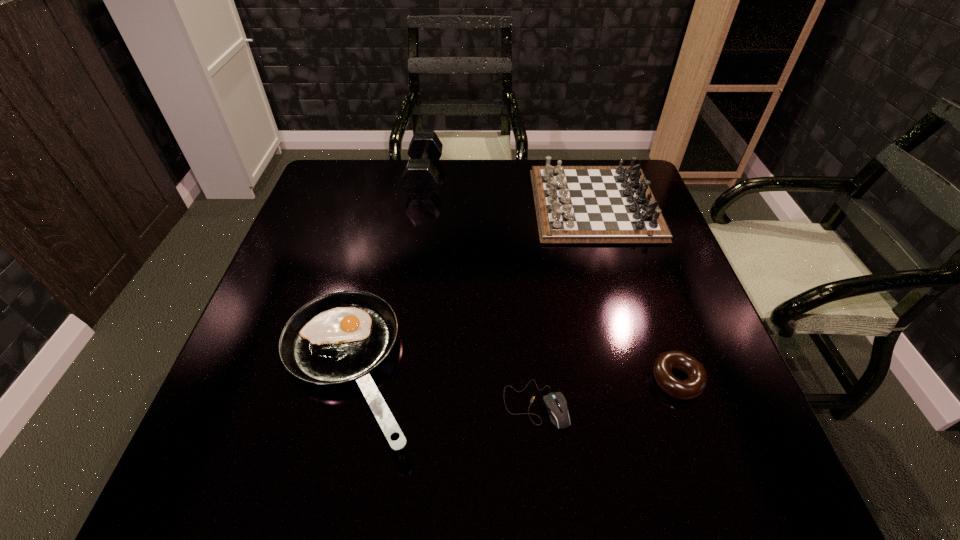
You are a GUI agent. You are given a task and a screenshot of the screen. Output one action in this format:
    pyautogui.click(x=<x>, y=<y>)
    Task: Click on the dumbbell
    This screenshot has width=960, height=540.
    Given the screenshot: What is the action you would take?
    pyautogui.click(x=420, y=179)

In order to click on the fourth shortest object in this screenshot , I will do `click(574, 204)`.

Where is `frying pan`? Image resolution: width=960 pixels, height=540 pixels. frying pan is located at coordinates (340, 336).

Locate an element on the screen. This screenshot has width=960, height=540. the second shortest object is located at coordinates (692, 387).

Find the location of a particular element. The height and width of the screenshot is (540, 960). computer mouse is located at coordinates (556, 404).

Find the location of `free space located on the front of the dumbbell`. free space located on the front of the dumbbell is located at coordinates (414, 245).

Locate an element on the screen. The height and width of the screenshot is (540, 960). free space located from the player's perspective of the chessboard is located at coordinates pyautogui.click(x=401, y=204).

Identify the location of free space located from the player's perspective of the chessboard. (461, 204).

Find the location of `blank space located from the player's perspective of the chessboard`. blank space located from the player's perspective of the chessboard is located at coordinates (492, 204).

Identify the location of vacant region located 0.090m on the right of the frying pan. (465, 370).